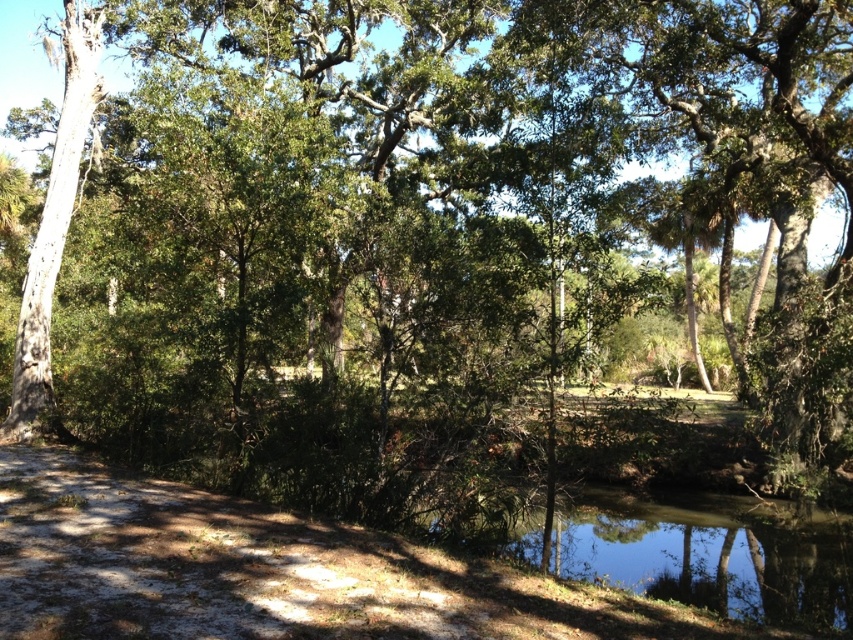
Question: Can you confirm if clear water at lower center is thinner than smooth white tree trunk at left?

Choices:
 (A) yes
 (B) no

Answer: (B)

Question: Which object appears farthest from the camera in this image?

Choices:
 (A) clear water at lower center
 (B) smooth white tree trunk at left

Answer: (B)

Question: Is clear water at lower center bigger than smooth white tree trunk at left?

Choices:
 (A) no
 (B) yes

Answer: (B)

Question: Which of the following is the farthest from the observer?

Choices:
 (A) clear water at lower center
 (B) smooth white tree trunk at left

Answer: (B)

Question: Observing the image, what is the correct spatial positioning of clear water at lower center in reference to smooth white tree trunk at left?

Choices:
 (A) above
 (B) below

Answer: (B)